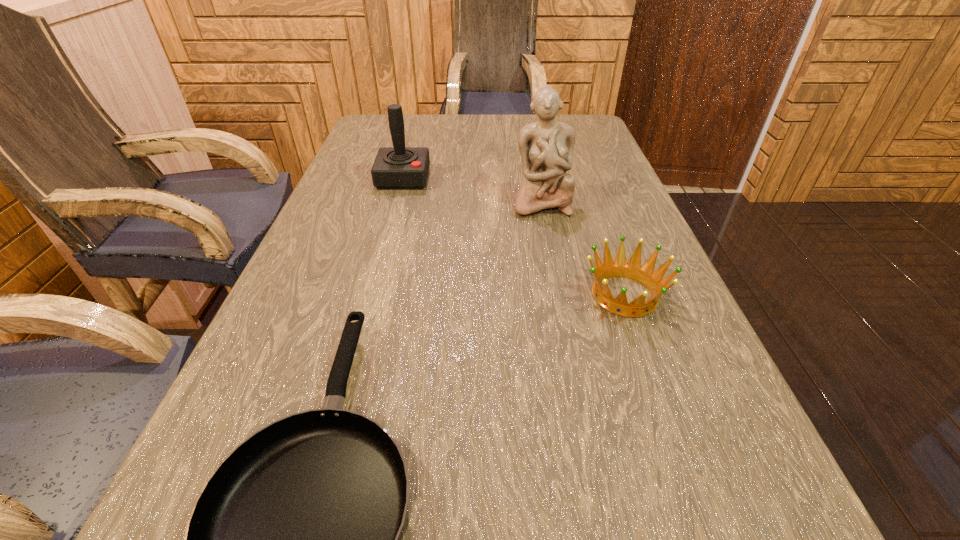
The image size is (960, 540). I want to click on vacant space at the far edge of the desktop, so click(x=515, y=143).

Where is `vacant space at the left edge of the desktop`? vacant space at the left edge of the desktop is located at coordinates (334, 260).

In order to click on free region at the right edge of the desktop in this screenshot , I will do `click(712, 408)`.

Locate an element on the screen. The height and width of the screenshot is (540, 960). vacant space at the far right corner of the desktop is located at coordinates (561, 119).

Locate an element on the screen. This screenshot has width=960, height=540. free area in between the tallest object and the second tallest object is located at coordinates (472, 191).

Where is `free point between the joystick and the tallest object`? free point between the joystick and the tallest object is located at coordinates (472, 191).

Where is `free space between the second tallest object and the second shortest object`? This screenshot has width=960, height=540. free space between the second tallest object and the second shortest object is located at coordinates (514, 237).

Locate an element on the screen. Image resolution: width=960 pixels, height=540 pixels. free spot between the second shortest object and the tallest object is located at coordinates (583, 249).

Locate an element on the screen. Image resolution: width=960 pixels, height=540 pixels. free spot between the second shortest object and the figurine is located at coordinates (583, 249).

Where is `object identified as the second closest to the third farthest object`? The width and height of the screenshot is (960, 540). object identified as the second closest to the third farthest object is located at coordinates [x=295, y=539].